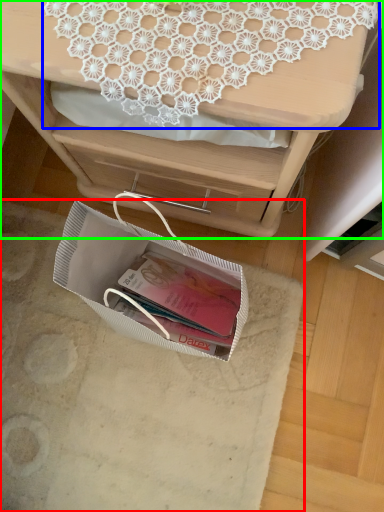
Question: Considering the real-world distances, which object is farthest from place mat (highlighted by a red box)? lace (highlighted by a blue box) or desk (highlighted by a green box)?

Choices:
 (A) lace
 (B) desk

Answer: (A)